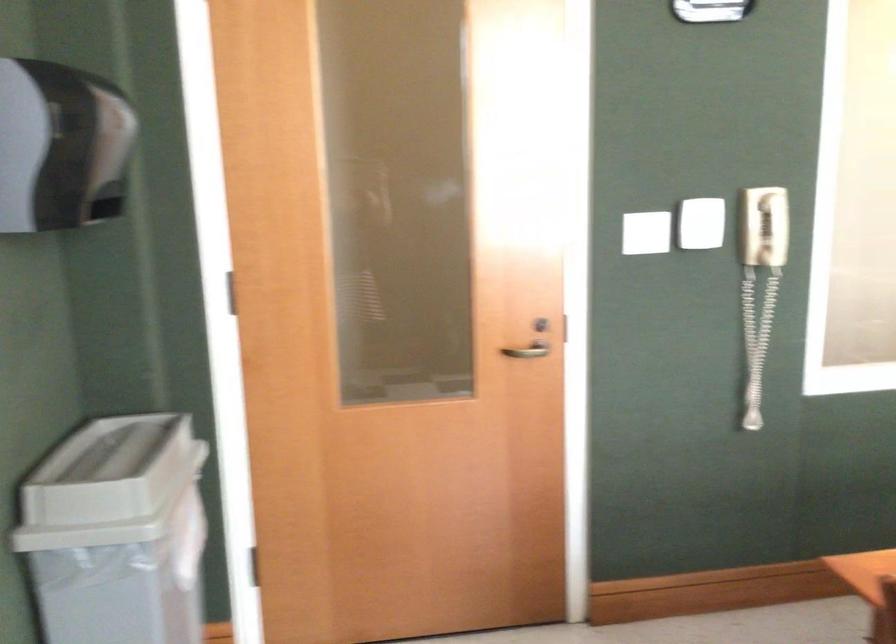
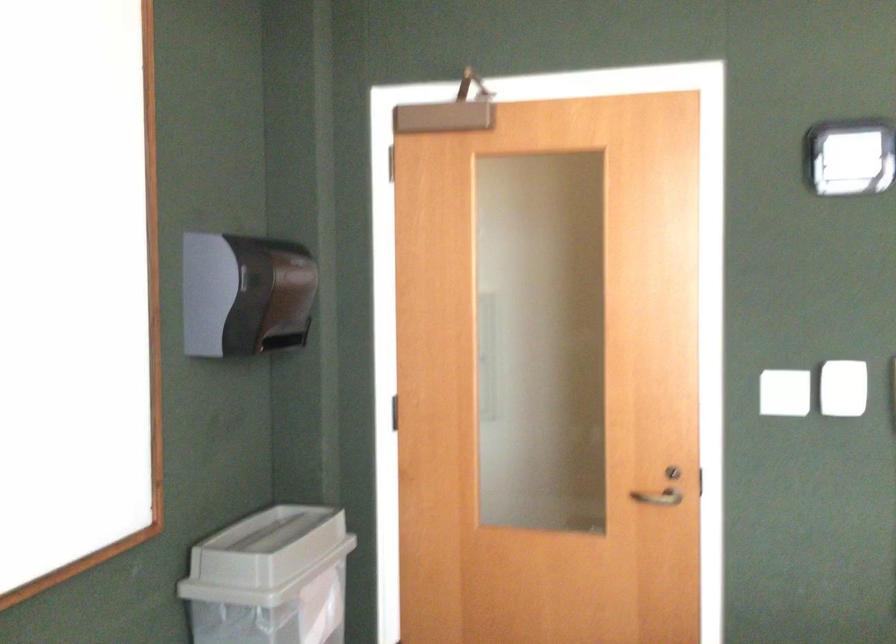
Question: What movement of the cameraman would produce the second image?

Choices:
 (A) Left
 (B) Right
 (C) Forward
 (D) Backward

Answer: (B)